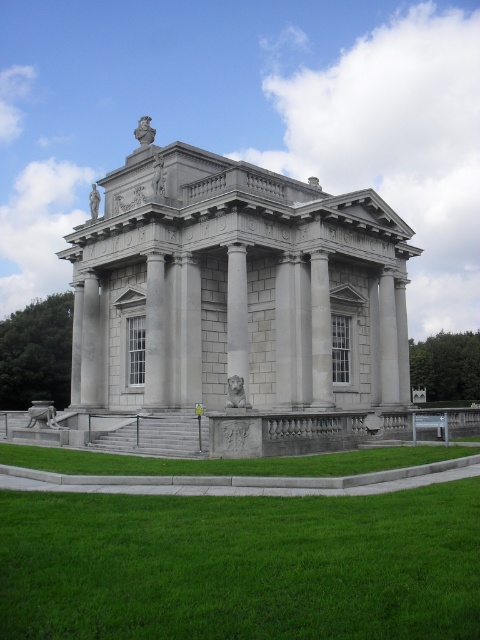
Question: Among these objects, which one is nearest to the camera?

Choices:
 (A) slate gray stone column at center
 (B) green grass at lower center

Answer: (B)

Question: Is green grass at lower center to the left of slate gray stone column at center from the viewer's perspective?

Choices:
 (A) no
 (B) yes

Answer: (B)

Question: Which point is closer to the camera?

Choices:
 (A) (228, 369)
 (B) (412, 456)

Answer: (B)

Question: Among these points, which one is nearest to the camera?

Choices:
 (A) 239,374
 (B) 298,476

Answer: (B)

Question: Is green grass at lower center wider than slate gray stone column at center?

Choices:
 (A) no
 (B) yes

Answer: (B)

Question: Is green grass at lower center closer to camera compared to slate gray stone column at center?

Choices:
 (A) no
 (B) yes

Answer: (B)